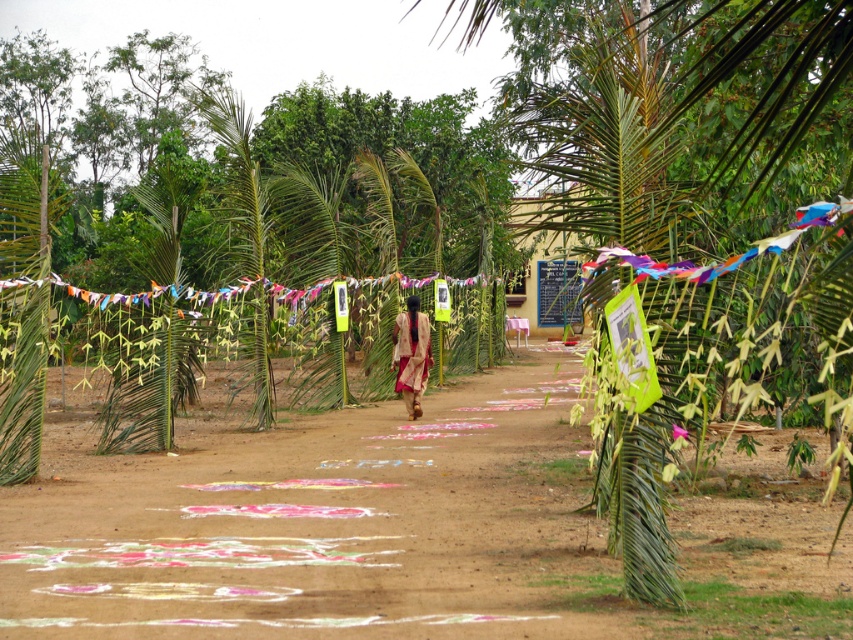
You are standing at the entrance of the dirt path and want to take a photo of the green leafy palm tree at center. According to the scene description, where should you position yourself relative to the path to capture the tree in the frame?

The green leafy palm tree at center is located at point [602,141], so you should position yourself near the center of the path to capture it in the frame.

You are standing on the dirt path in the middle of the scene. You see the colored sand art at center and the green leafy palm tree at center. Which object is positioned to the left of the other?

The colored sand art at center is to the left of the green leafy palm tree at center.

You are a tourist visiting this tropical area and want to take a photo of the colored sand art at center. Where should you stand to get the best view?

The colored sand art at center is located at point (320, 525), so you should stand directly in front of that coordinate to capture the best view.